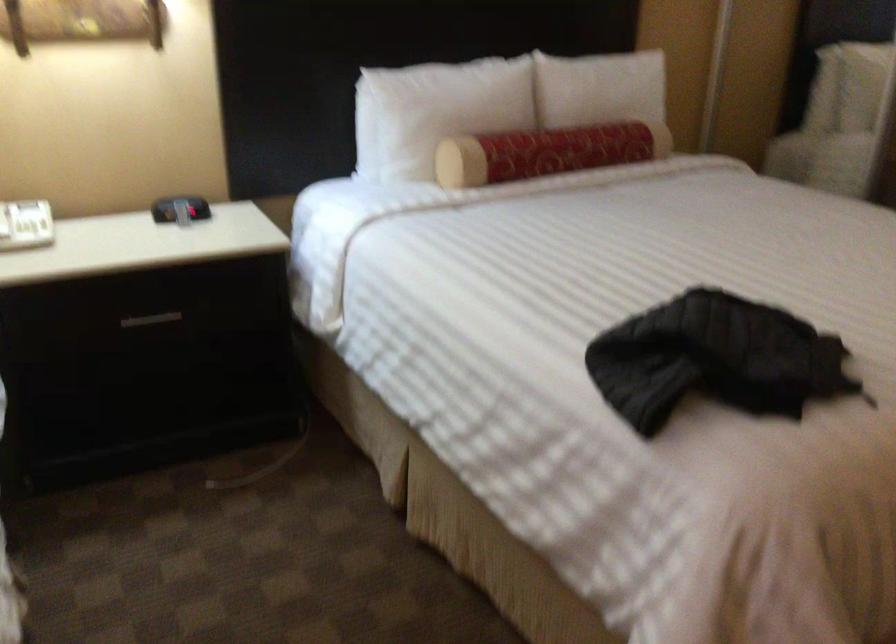
Where would you pull the nightstand drawer handle? Please return your answer as a coordinate pair (x, y).

(151, 319)